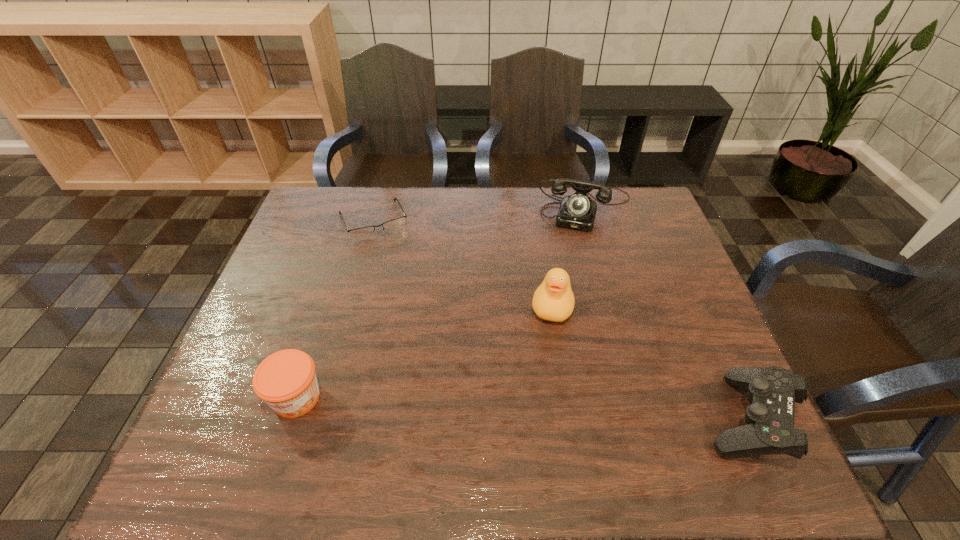
In order to click on jam in this screenshot , I will do [286, 380].

The width and height of the screenshot is (960, 540). In order to click on control in this screenshot , I will do `click(769, 429)`.

The height and width of the screenshot is (540, 960). Identify the location of the shortest object. (393, 225).

The height and width of the screenshot is (540, 960). Find the location of `duck`. duck is located at coordinates tap(553, 300).

At what (x,y) coordinates should I click in order to perform the action: click on the tallest object. Please return your answer as a coordinate pair (x, y). Image resolution: width=960 pixels, height=540 pixels. Looking at the image, I should click on (553, 300).

The image size is (960, 540). In order to click on telephone in this screenshot , I will do `click(577, 211)`.

What are the coordinates of `free space located on the back of the control` in the screenshot? It's located at (705, 325).

You are a GUI agent. You are given a task and a screenshot of the screen. Output one action in this format:
    pyautogui.click(x=<x>, y=<y>)
    Task: Click on the vacant space located 0.350m on the front-facing side of the spectacles
    
    Given the screenshot: What is the action you would take?
    pyautogui.click(x=421, y=323)

I want to click on vacant space located 0.200m on the front-facing side of the spectacles, so coord(403,284).

Where is `free space located 0.300m on the front-facing side of the spectacles`? This screenshot has height=540, width=960. free space located 0.300m on the front-facing side of the spectacles is located at coordinates (415, 309).